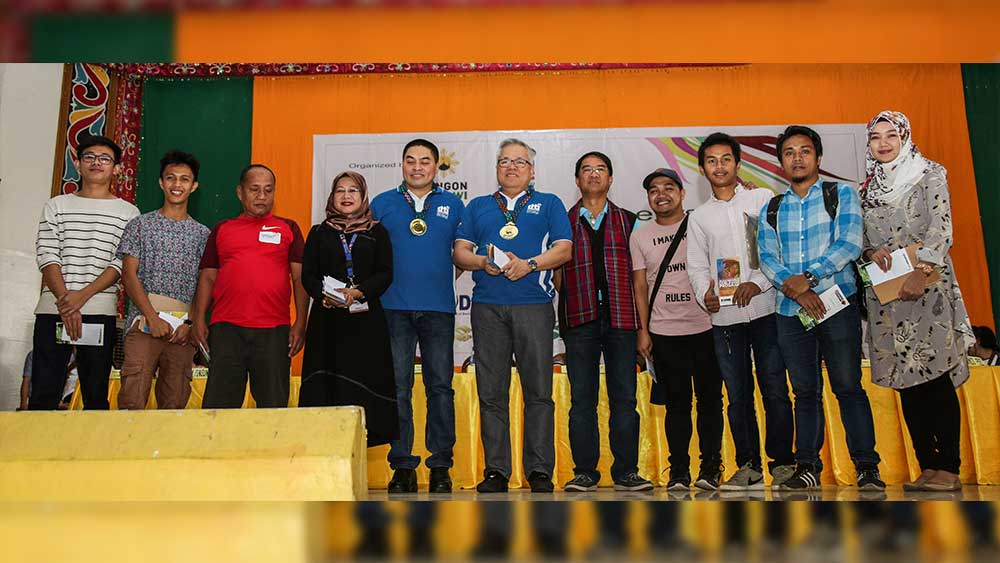
Identify the location of floor. This screenshot has height=563, width=1000. (239, 530).